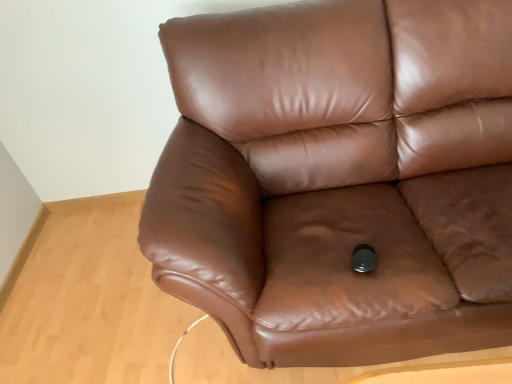
The image size is (512, 384). Find the location of `brown leather couch at center`. brown leather couch at center is located at coordinates (340, 179).

This screenshot has height=384, width=512. Describe the element at coordinates (340, 179) in the screenshot. I see `brown leather couch at center` at that location.

Where is `brown leather couch at center`? brown leather couch at center is located at coordinates (340, 179).